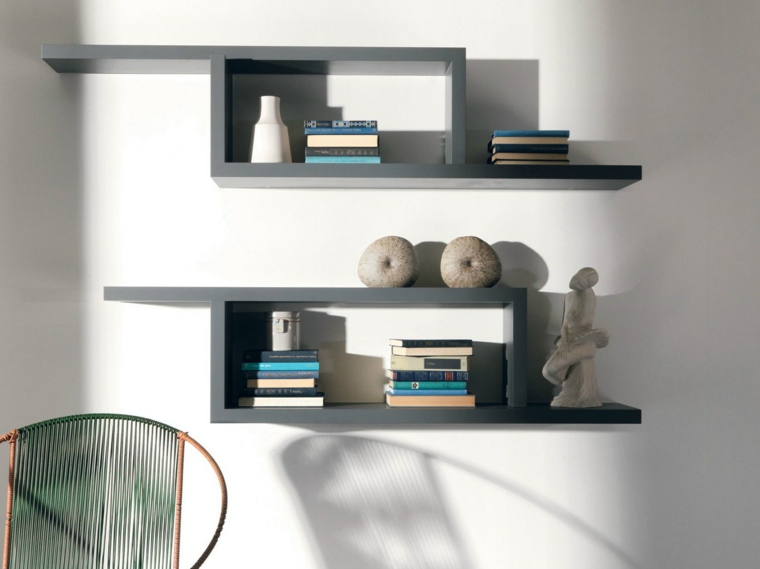
You are a GUI agent. You are given a task and a screenshot of the screen. Output one action in this format:
    pyautogui.click(x=<x>, y=<y>)
    Task: Click on the books on right side of bottom shelf
    The image size is (760, 569).
    Given the screenshot: What is the action you would take?
    pyautogui.click(x=448, y=397), pyautogui.click(x=419, y=391), pyautogui.click(x=400, y=382), pyautogui.click(x=426, y=375), pyautogui.click(x=416, y=365), pyautogui.click(x=413, y=352), pyautogui.click(x=435, y=342)